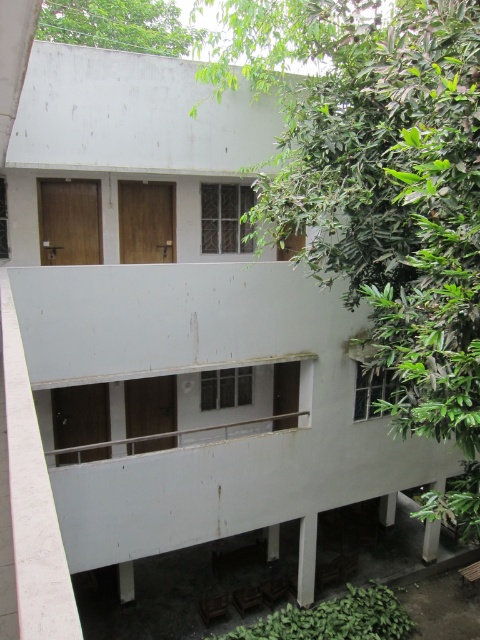
Which is above, green leafy tree at upper right or green leafy tree at upper left?

green leafy tree at upper left is higher up.

Is green leafy tree at upper right positioned behind green leafy tree at upper left?

No.

Is point (302, 209) positioned before point (94, 44)?

Yes, point (302, 209) is closer to viewer.

The width and height of the screenshot is (480, 640). I want to click on green leafy tree at upper right, so click(x=382, y=189).